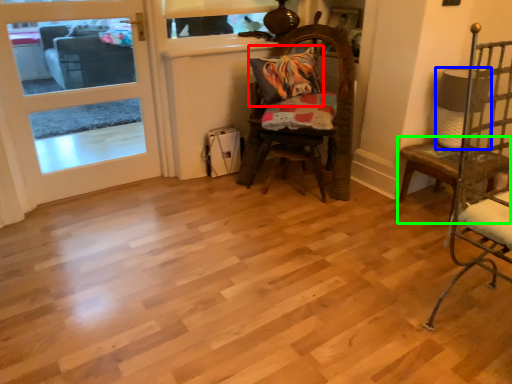
Question: Considering the real-world distances, which object is closest to pillow (highlighted by a red box)? lamp (highlighted by a blue box) or table (highlighted by a green box).

Choices:
 (A) lamp
 (B) table

Answer: (A)